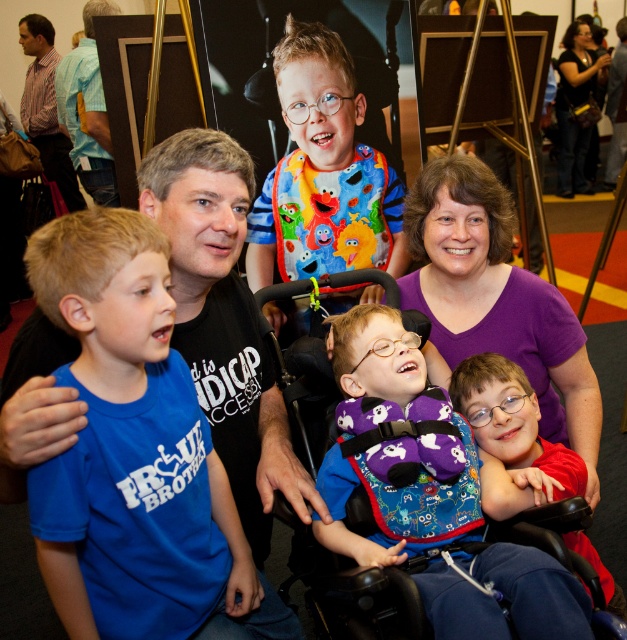
Question: Which object appears closest to the camera in this image?

Choices:
 (A) purple fabric vest at center
 (B) striped cotton shirt at upper left

Answer: (A)

Question: Is purple fabric vest at center positioned before purple fabric at center?

Choices:
 (A) no
 (B) yes

Answer: (B)

Question: Which of these objects is positioned closest to the purple fabric vest at center?

Choices:
 (A) striped cotton shirt at upper left
 (B) multicolored bib at center
 (C) purple fabric at center
 (D) blue cotton shirt at left

Answer: (C)

Question: Can you confirm if purple fabric vest at center is wider than multicolored bib at center?

Choices:
 (A) no
 (B) yes

Answer: (A)

Question: Which point is closer to the camera?

Choices:
 (A) (43, 228)
 (B) (623, 600)
 (C) (33, 96)

Answer: (A)

Question: Is the position of purple fabric vest at center more distant than that of purple fabric at center?

Choices:
 (A) no
 (B) yes

Answer: (A)